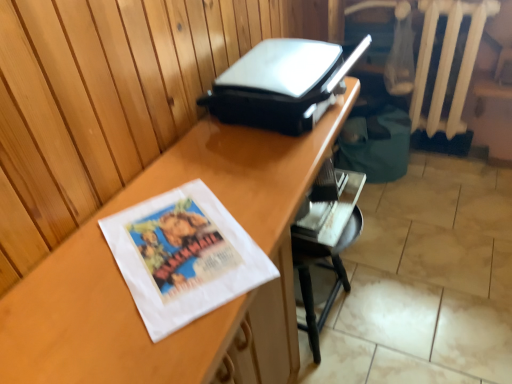
Question: Does metallic silver chair at lower right touch white painted wood radiator at upper right?

Choices:
 (A) yes
 (B) no

Answer: (B)

Question: From the image's perspective, is metallic silver chair at lower right below white painted wood radiator at upper right?

Choices:
 (A) no
 (B) yes

Answer: (B)

Question: Can you confirm if metallic silver chair at lower right is taller than white painted wood radiator at upper right?

Choices:
 (A) no
 (B) yes

Answer: (A)

Question: Is the position of metallic silver chair at lower right more distant than that of white painted wood radiator at upper right?

Choices:
 (A) yes
 (B) no

Answer: (B)

Question: From the image's perspective, is metallic silver chair at lower right above white painted wood radiator at upper right?

Choices:
 (A) no
 (B) yes

Answer: (A)

Question: Is metallic silver chair at lower right at the right side of white painted wood radiator at upper right?

Choices:
 (A) yes
 (B) no

Answer: (B)

Question: Is wooden desk at center outside of metallic silver chair at lower right?

Choices:
 (A) yes
 (B) no

Answer: (A)

Question: Considering the relative sizes of wooden desk at center and metallic silver chair at lower right in the image provided, is wooden desk at center wider than metallic silver chair at lower right?

Choices:
 (A) no
 (B) yes

Answer: (B)

Question: Can you confirm if wooden desk at center is positioned to the right of metallic silver chair at lower right?

Choices:
 (A) no
 (B) yes

Answer: (A)

Question: Can you confirm if wooden desk at center is thinner than metallic silver chair at lower right?

Choices:
 (A) yes
 (B) no

Answer: (B)

Question: Considering the relative sizes of wooden desk at center and metallic silver chair at lower right in the image provided, is wooden desk at center shorter than metallic silver chair at lower right?

Choices:
 (A) no
 (B) yes

Answer: (A)

Question: Considering the relative sizes of wooden desk at center and metallic silver chair at lower right in the image provided, is wooden desk at center smaller than metallic silver chair at lower right?

Choices:
 (A) yes
 (B) no

Answer: (B)

Question: Does white painted wood radiator at upper right have a smaller size compared to metallic silver chair at lower right?

Choices:
 (A) yes
 (B) no

Answer: (A)